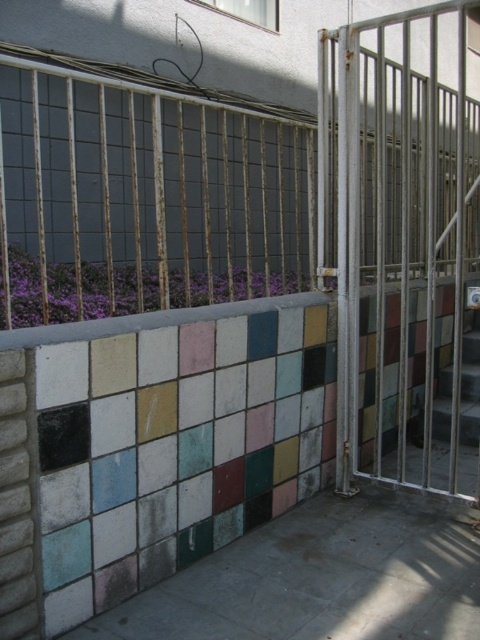
Who is more forward, (x=105, y=193) or (x=417, y=400)?

Point (x=105, y=193)

Is rusty metal fence at center positioned behind metallic gate at right?

No, rusty metal fence at center is in front of metallic gate at right.

Where is `rusty metal fence at center`? The width and height of the screenshot is (480, 640). rusty metal fence at center is located at coordinates tap(144, 198).

Find the location of a particular element. This screenshot has width=480, height=640. rusty metal fence at center is located at coordinates (144, 198).